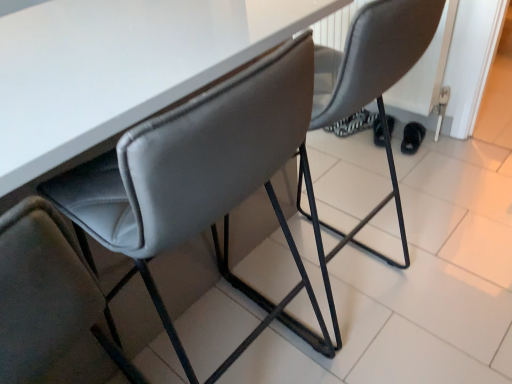
Question: Is matte gray chair at center, the 2th chair viewed from the left, not inside black fuzzy slipper at lower right?

Choices:
 (A) yes
 (B) no

Answer: (A)

Question: Is matte gray chair at center, the 2th chair viewed from the left, shorter than black fuzzy slipper at lower right?

Choices:
 (A) no
 (B) yes

Answer: (A)

Question: Is matte gray chair at center, the 2th chair viewed from the left, positioned in front of black fuzzy slipper at lower right?

Choices:
 (A) yes
 (B) no

Answer: (A)

Question: From a real-world perspective, is matte gray chair at center, the first chair when ordered from right to left, positioned under black fuzzy slipper at lower right based on gravity?

Choices:
 (A) yes
 (B) no

Answer: (B)

Question: Is matte gray chair at center, the 2th chair viewed from the left, with black fuzzy slipper at lower right?

Choices:
 (A) no
 (B) yes

Answer: (A)

Question: Is matte gray chair at center, the first chair when ordered from right to left, bigger than black fuzzy slipper at lower right?

Choices:
 (A) no
 (B) yes

Answer: (B)

Question: Can you confirm if black fuzzy slipper at lower right is shorter than suede-like gray chair at center, which ranks as the 2th chair in right-to-left order?

Choices:
 (A) yes
 (B) no

Answer: (A)

Question: Is black fuzzy slipper at lower right next to suede-like gray chair at center, the 1th chair from the left, and touching it?

Choices:
 (A) no
 (B) yes

Answer: (A)

Question: From the image's perspective, is black fuzzy slipper at lower right under suede-like gray chair at center, which ranks as the 2th chair in right-to-left order?

Choices:
 (A) no
 (B) yes

Answer: (A)

Question: From a real-world perspective, is black fuzzy slipper at lower right located beneath suede-like gray chair at center, which ranks as the 2th chair in right-to-left order?

Choices:
 (A) yes
 (B) no

Answer: (A)

Question: Is black fuzzy slipper at lower right not within suede-like gray chair at center, which ranks as the 2th chair in right-to-left order?

Choices:
 (A) no
 (B) yes

Answer: (B)

Question: Can you confirm if black fuzzy slipper at lower right is smaller than suede-like gray chair at center, the 1th chair from the left?

Choices:
 (A) yes
 (B) no

Answer: (A)

Question: Is suede-like gray chair at center, which ranks as the 2th chair in right-to-left order, taller than black fuzzy slipper at lower right?

Choices:
 (A) yes
 (B) no

Answer: (A)